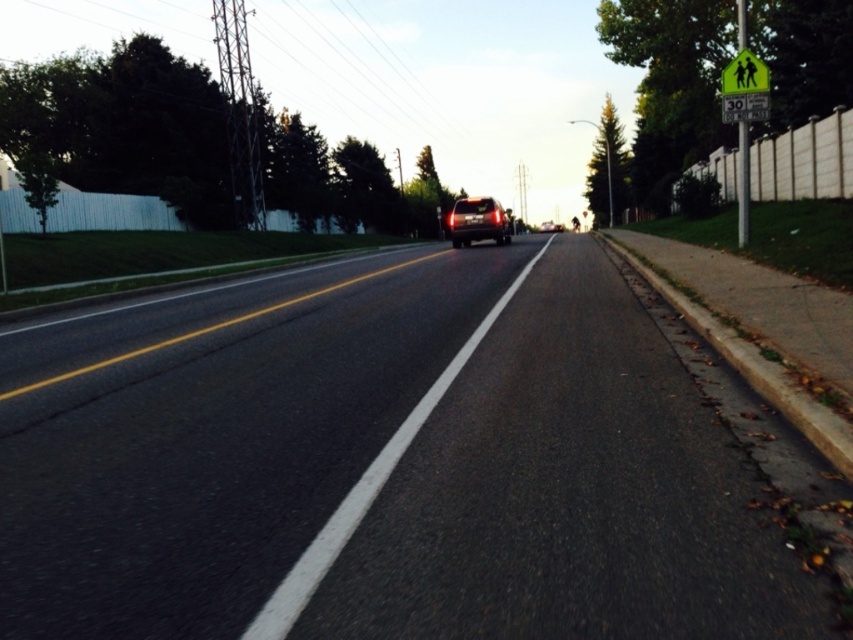
You are a pedestrian waiting at the roadside and see the black asphalt road at center and the green reflective pedestrian crossing sign at upper right. Which object is closer to you as you face the road?

The green reflective pedestrian crossing sign at upper right is closer to you because it is positioned above the black asphalt road at center, indicating it is nearer in the visual field.